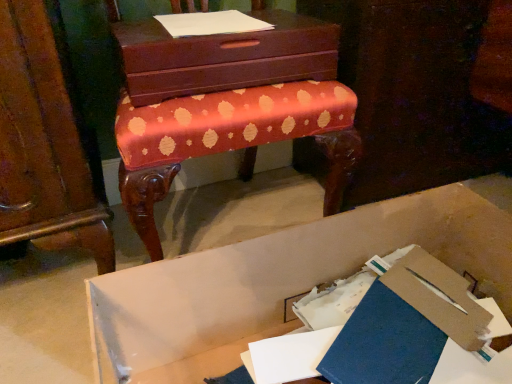
Question: Does white cardboard box at lower center lie in front of white paper at upper center?

Choices:
 (A) no
 (B) yes

Answer: (B)

Question: Considering the relative positions of white cardboard box at lower center and white paper at upper center in the image provided, is white cardboard box at lower center to the right of white paper at upper center from the viewer's perspective?

Choices:
 (A) no
 (B) yes

Answer: (B)

Question: Is white cardboard box at lower center oriented away from white paper at upper center?

Choices:
 (A) yes
 (B) no

Answer: (B)

Question: From the image's perspective, does white cardboard box at lower center appear lower than white paper at upper center?

Choices:
 (A) no
 (B) yes

Answer: (B)

Question: Does white cardboard box at lower center have a lesser height compared to white paper at upper center?

Choices:
 (A) yes
 (B) no

Answer: (B)

Question: From a real-world perspective, is white cardboard box at lower center over white paper at upper center?

Choices:
 (A) no
 (B) yes

Answer: (A)

Question: From a real-world perspective, is blue matte paper at lower center positioned under matte brown chest of drawers at upper center based on gravity?

Choices:
 (A) yes
 (B) no

Answer: (A)

Question: Is blue matte paper at lower center at the right side of matte brown chest of drawers at upper center?

Choices:
 (A) no
 (B) yes

Answer: (B)

Question: Is the depth of blue matte paper at lower center less than that of matte brown chest of drawers at upper center?

Choices:
 (A) yes
 (B) no

Answer: (A)

Question: Is blue matte paper at lower center directly adjacent to matte brown chest of drawers at upper center?

Choices:
 (A) yes
 (B) no

Answer: (B)

Question: Can you confirm if blue matte paper at lower center is taller than matte brown chest of drawers at upper center?

Choices:
 (A) no
 (B) yes

Answer: (A)

Question: Would you consider blue matte paper at lower center to be distant from matte brown chest of drawers at upper center?

Choices:
 (A) no
 (B) yes

Answer: (A)

Question: Would you say white paper at upper center is outside matte brown chest of drawers at upper center?

Choices:
 (A) yes
 (B) no

Answer: (B)